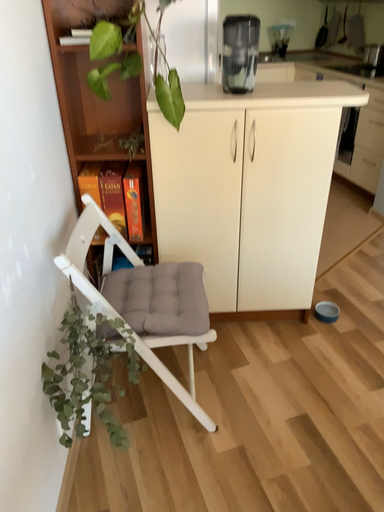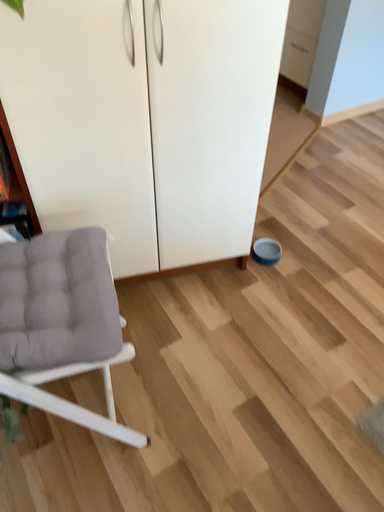
Question: Which way did the camera rotate in the video?

Choices:
 (A) rotated right
 (B) rotated left

Answer: (A)